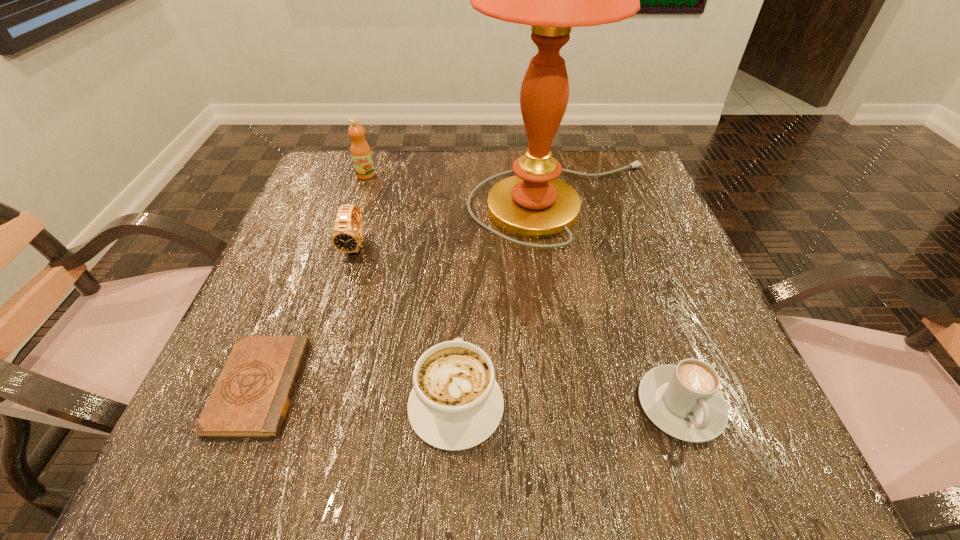
Find the location of a particular element. lamp that is at the right edge is located at coordinates (534, 204).

You are a GUI agent. You are given a task and a screenshot of the screen. Output one action in this format:
    pyautogui.click(x=<x>, y=<y>)
    Task: Click on the cappuccino at the right edge
    The height and width of the screenshot is (540, 960).
    Given the screenshot: What is the action you would take?
    pyautogui.click(x=684, y=400)

You are a GUI agent. You are given a task and a screenshot of the screen. Output one action in this format:
    pyautogui.click(x=<x>, y=<y>)
    Task: Click on the object that is positioned at the far left corner
    This screenshot has height=540, width=960.
    Given the screenshot: What is the action you would take?
    pos(361,155)

Find the location of `object that is at the near left corner`. object that is at the near left corner is located at coordinates (251, 398).

Where is `object located at the far right corner`? object located at the far right corner is located at coordinates (534, 204).

This screenshot has height=540, width=960. In order to click on object present at the near right corner in this screenshot , I will do `click(684, 400)`.

Where is `vacant space at the far edge of the desktop`? vacant space at the far edge of the desktop is located at coordinates (458, 175).

Locate an element on the screen. The image size is (960, 540). free space at the near edge of the desktop is located at coordinates [390, 470].

The image size is (960, 540). I want to click on vacant space at the right edge, so click(x=644, y=310).

I want to click on vacant space at the far left corner, so click(344, 172).